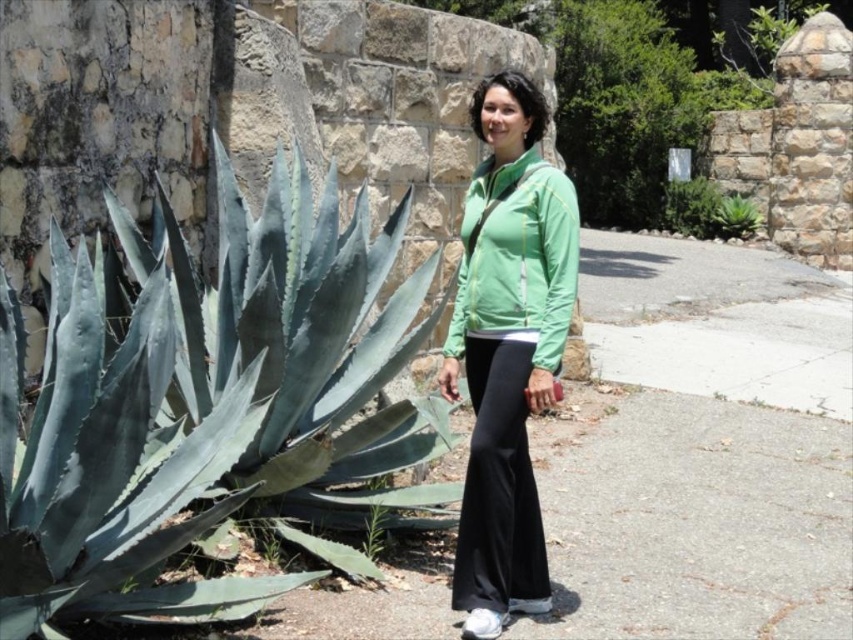
You are a gardener who wants to plant both the green leafy plant at center and the green succulent at center in a rectangular garden bed. The garden bed is exactly 1 meter wide. Which plant should you place first to ensure both can fit side by side?

The green leafy plant at center has a larger width than the green succulent at center. To fit both side by side in the 1 meter wide garden bed, place the wider green leafy plant at center first, then the narrower green succulent at center. This arrangement ensures there is enough space for both plants.

You are standing at the point marked by coordinates (202, 401). Which object are you closest to?

You are closest to the green succulent at left because the point (202, 401) is on the green succulent at left.